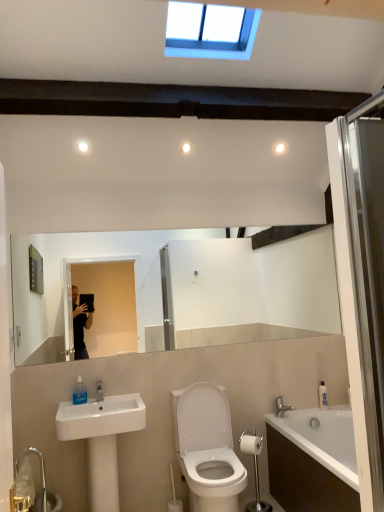
Question: In terms of height, does white matte toilet paper at lower right look taller or shorter compared to transparent glass shower door at right?

Choices:
 (A) tall
 (B) short

Answer: (B)

Question: Is white matte toilet paper at lower right wider or thinner than transparent glass shower door at right?

Choices:
 (A) thin
 (B) wide

Answer: (B)

Question: Which is farther from the white glossy bathtub at lower right?

Choices:
 (A) silver metallic faucet at lower right
 (B) white plastic soap dispenser at lower right, the first toiletry positioned from the bottom
 (C) white matte toilet paper at lower right
 (D) transparent plastic soap dispenser at lower left, acting as the second toiletry starting from the right
 (E) transparent glass shower door at right

Answer: (D)

Question: Which is farther from the silver metallic faucet at lower right?

Choices:
 (A) transparent glass shower door at right
 (B) blue plastic window at upper center
 (C) transparent plastic soap dispenser at lower left, acting as the first toiletry starting from the left
 (D) white glossy sink at lower left
 (E) white plastic soap dispenser at lower right, the second toiletry when ordered from left to right

Answer: (B)